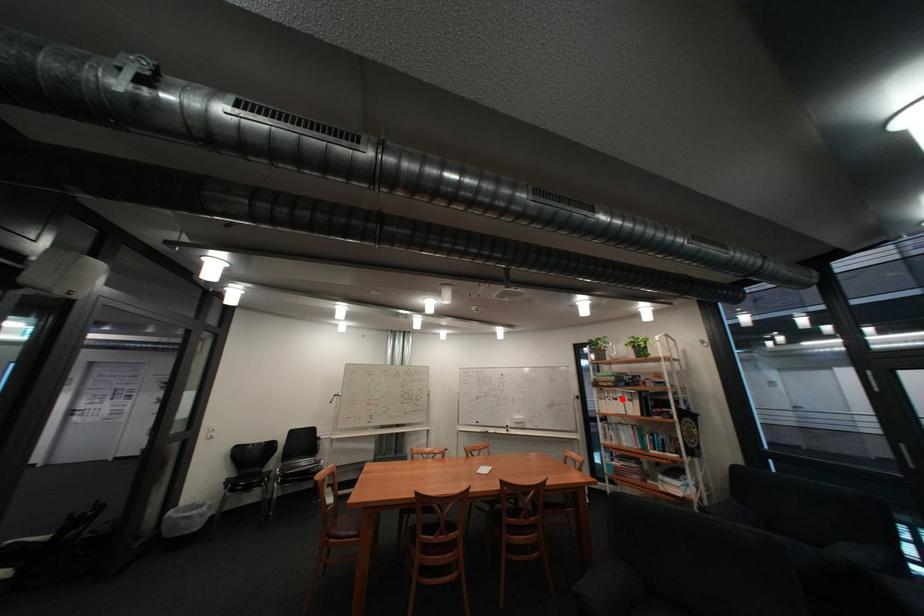
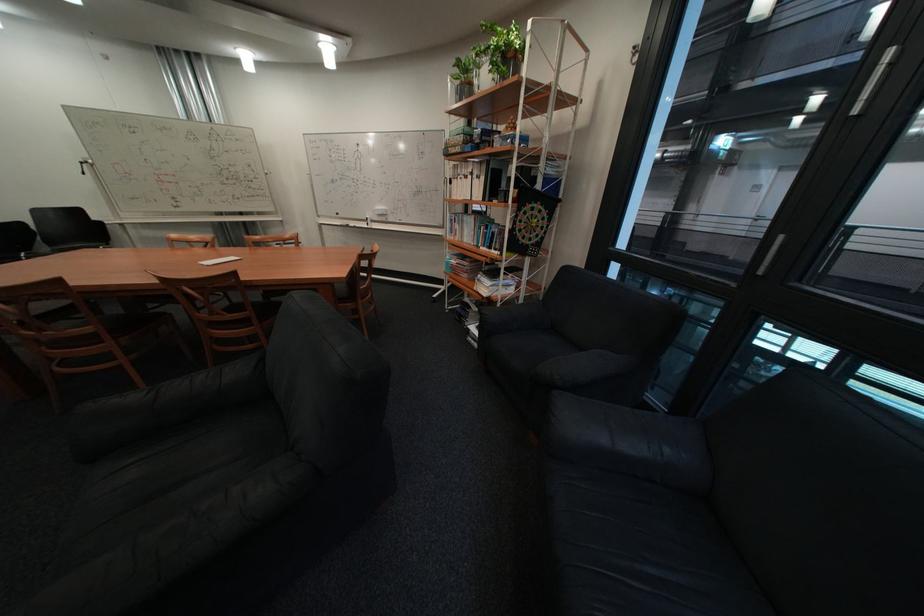
Question: I am providing you with two images of the same scene from different viewpoints. Image1 has a red point marked. In image2, the corresponding 3D location appears at what relative position? Reply with the corresponding letter.

Choices:
 (A) Closer
 (B) Farther

Answer: (A)